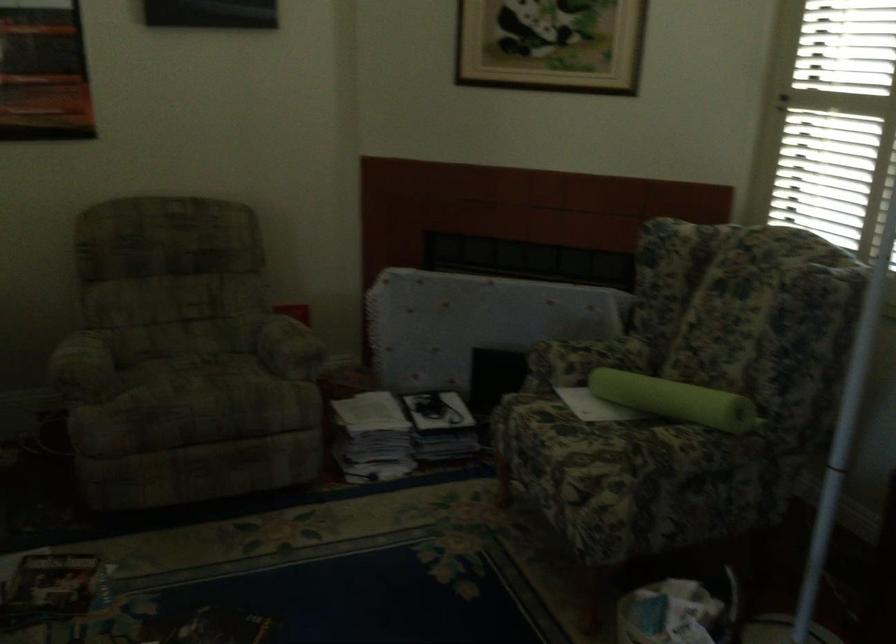
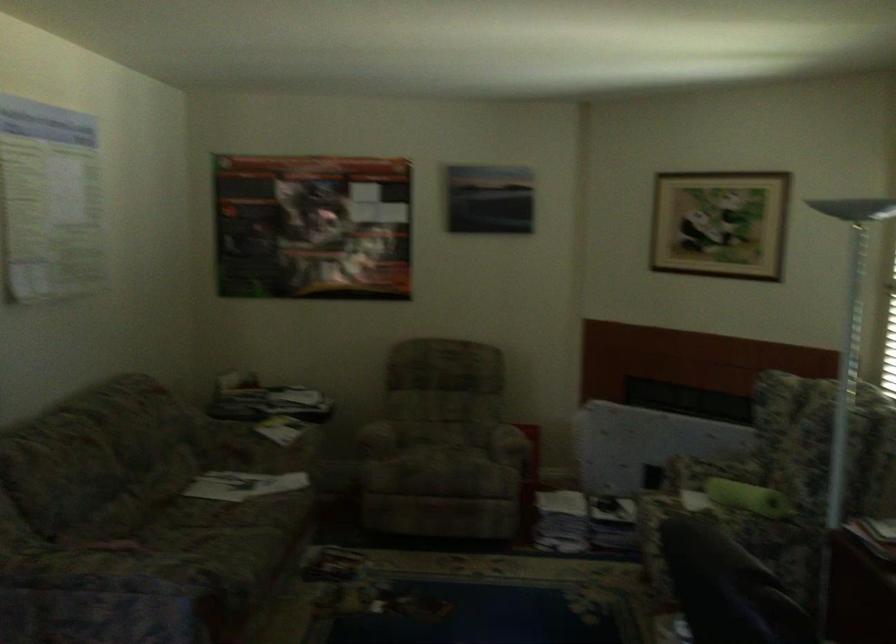
Where in the second image is the point corresponding to point (184, 372) from the first image?

(436, 451)